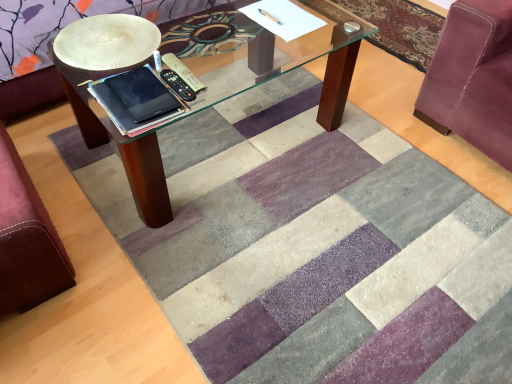
Where is `black matte tablet at center`? black matte tablet at center is located at coordinates pyautogui.click(x=142, y=94).

This screenshot has height=384, width=512. Describe the element at coordinates (400, 28) in the screenshot. I see `silky purple rug at upper right` at that location.

Based on the photo, what is the approximate height of velvet maroon swivel chair at right, marked as the 1th swivel chair in a right-to-left arrangement?

The height of velvet maroon swivel chair at right, marked as the 1th swivel chair in a right-to-left arrangement, is 26.35 inches.

In order to click on black matte tablet at center in this screenshot , I will do `click(142, 94)`.

From a real-world perspective, is black matte tablet at center physically above silky purple rug at upper right?

Indeed, from a real-world perspective, black matte tablet at center stands above silky purple rug at upper right.

Measure the distance between black matte tablet at center and silky purple rug at upper right.

black matte tablet at center is 1.75 meters from silky purple rug at upper right.

This screenshot has height=384, width=512. I want to click on ipad above the silky purple rug at upper right (from a real-world perspective), so click(x=142, y=94).

Considering their positions, is black matte tablet at center located in front of or behind silky purple rug at upper right?

In the image, black matte tablet at center appears in front of silky purple rug at upper right.

From the image's perspective, does velvet burgundy swivel chair at lower left, which is counted as the second swivel chair, starting from the right, appear lower than black plastic remote at center?

Yes.

From a real-world perspective, which is physically above, velvet burgundy swivel chair at lower left, which is counted as the second swivel chair, starting from the right, or black plastic remote at center?

From a 3D spatial view, black plastic remote at center is above.

Is the position of velvet burgundy swivel chair at lower left, the 1th swivel chair in the left-to-right sequence, more distant than that of black plastic remote at center?

No.

Would you say velvet burgundy swivel chair at lower left, which is counted as the second swivel chair, starting from the right, is to the left or to the right of black plastic remote at center in the picture?

Clearly, velvet burgundy swivel chair at lower left, which is counted as the second swivel chair, starting from the right, is on the left of black plastic remote at center in the image.

Could you tell me if velvet maroon swivel chair at right, marked as the 1th swivel chair in a right-to-left arrangement, is turned towards black plastic remote at center?

Yes, velvet maroon swivel chair at right, marked as the 1th swivel chair in a right-to-left arrangement, faces towards black plastic remote at center.

Is velvet maroon swivel chair at right, marked as the 1th swivel chair in a right-to-left arrangement, positioned before black plastic remote at center?

Yes, velvet maroon swivel chair at right, marked as the 1th swivel chair in a right-to-left arrangement, is in front of black plastic remote at center.

Which object is thinner, velvet maroon swivel chair at right, marked as the 1th swivel chair in a right-to-left arrangement, or black plastic remote at center?

With smaller width is black plastic remote at center.

Do you think velvet maroon swivel chair at right, marked as the 1th swivel chair in a right-to-left arrangement, is within velvet burgundy swivel chair at lower left, the 1th swivel chair in the left-to-right sequence, or outside of it?

velvet maroon swivel chair at right, marked as the 1th swivel chair in a right-to-left arrangement, exists outside the volume of velvet burgundy swivel chair at lower left, the 1th swivel chair in the left-to-right sequence.

Which of these two, velvet maroon swivel chair at right, marked as the 1th swivel chair in a right-to-left arrangement, or velvet burgundy swivel chair at lower left, the 1th swivel chair in the left-to-right sequence, is wider?

velvet maroon swivel chair at right, marked as the 1th swivel chair in a right-to-left arrangement, is wider.

Does point (455, 79) lie behind point (24, 290)?

Yes, it is behind point (24, 290).

From the image's perspective, between velvet maroon swivel chair at right, placed as the 2th swivel chair when sorted from left to right, and velvet burgundy swivel chair at lower left, the 1th swivel chair in the left-to-right sequence, which one is located above?

velvet maroon swivel chair at right, placed as the 2th swivel chair when sorted from left to right, from the image's perspective.

Can you confirm if silky purple rug at upper right is smaller than velvet maroon swivel chair at right, marked as the 1th swivel chair in a right-to-left arrangement?

Yes.

Consider the image. Is velvet maroon swivel chair at right, placed as the 2th swivel chair when sorted from left to right, surrounded by silky purple rug at upper right?

No, velvet maroon swivel chair at right, placed as the 2th swivel chair when sorted from left to right, is not inside silky purple rug at upper right.

From the image's perspective, is silky purple rug at upper right positioned above or below velvet maroon swivel chair at right, marked as the 1th swivel chair in a right-to-left arrangement?

silky purple rug at upper right is above velvet maroon swivel chair at right, marked as the 1th swivel chair in a right-to-left arrangement.

From a real-world perspective, which is physically above, silky purple rug at upper right or velvet maroon swivel chair at right, placed as the 2th swivel chair when sorted from left to right?

velvet maroon swivel chair at right, placed as the 2th swivel chair when sorted from left to right, is physically above.

Consider the image. Is there a large distance between black plastic remote at center and black matte tablet at center?

No, there isn't a large distance between black plastic remote at center and black matte tablet at center.

In the scene shown: Is black plastic remote at center positioned with its back to black matte tablet at center?

black plastic remote at center is not turned away from black matte tablet at center.

Is black matte tablet at center surrounded by black plastic remote at center?

That's incorrect, black matte tablet at center is not inside black plastic remote at center.

Is point (200, 82) farther from viewer compared to point (158, 100)?

Yes, point (200, 82) is farther from viewer.

Between velvet maroon swivel chair at right, placed as the 2th swivel chair when sorted from left to right, and black matte tablet at center, which one has larger width?

velvet maroon swivel chair at right, placed as the 2th swivel chair when sorted from left to right.

From the picture: How far apart are velvet maroon swivel chair at right, marked as the 1th swivel chair in a right-to-left arrangement, and black matte tablet at center?

velvet maroon swivel chair at right, marked as the 1th swivel chair in a right-to-left arrangement, is 4.08 feet away from black matte tablet at center.

Is velvet maroon swivel chair at right, placed as the 2th swivel chair when sorted from left to right, turned away from black matte tablet at center?

No, velvet maroon swivel chair at right, placed as the 2th swivel chair when sorted from left to right, is not facing away from black matte tablet at center.

Identify the location of mat behind the black matte tablet at center. pyautogui.click(x=400, y=28).

There is a velvet burgundy swivel chair at lower left, which is counted as the second swivel chair, starting from the right. What are the coordinates of `remote above it (from a real-world perspective)` in the screenshot? It's located at (183, 72).

Based on the photo, when comparing their distances from black plastic remote at center, does velvet burgundy swivel chair at lower left, which is counted as the second swivel chair, starting from the right, or black matte tablet at center seem further?

The object further to black plastic remote at center is velvet burgundy swivel chair at lower left, which is counted as the second swivel chair, starting from the right.

Looking at the image, which one is located closer to black matte tablet at center, black plastic remote at center or velvet burgundy swivel chair at lower left, the 1th swivel chair in the left-to-right sequence?

Based on the image, black plastic remote at center appears to be nearer to black matte tablet at center.

When comparing their distances from velvet maroon swivel chair at right, placed as the 2th swivel chair when sorted from left to right, does black matte tablet at center or silky purple rug at upper right seem further?

black matte tablet at center lies further to velvet maroon swivel chair at right, placed as the 2th swivel chair when sorted from left to right, than the other object.

Which object lies nearer to the anchor point black matte tablet at center, silky purple rug at upper right or velvet burgundy swivel chair at lower left, the 1th swivel chair in the left-to-right sequence?

Based on the image, velvet burgundy swivel chair at lower left, the 1th swivel chair in the left-to-right sequence, appears to be nearer to black matte tablet at center.

Estimate the real-world distances between objects in this image. Which object is closer to velvet burgundy swivel chair at lower left, the 1th swivel chair in the left-to-right sequence, black matte tablet at center or velvet maroon swivel chair at right, placed as the 2th swivel chair when sorted from left to right?

Among the two, black matte tablet at center is located nearer to velvet burgundy swivel chair at lower left, the 1th swivel chair in the left-to-right sequence.

Looking at this image, when comparing their distances from velvet maroon swivel chair at right, marked as the 1th swivel chair in a right-to-left arrangement, does velvet burgundy swivel chair at lower left, which is counted as the second swivel chair, starting from the right, or black matte tablet at center seem further?

velvet burgundy swivel chair at lower left, which is counted as the second swivel chair, starting from the right, lies further to velvet maroon swivel chair at right, marked as the 1th swivel chair in a right-to-left arrangement, than the other object.

Based on their spatial positions, is black plastic remote at center or velvet burgundy swivel chair at lower left, which is counted as the second swivel chair, starting from the right, closer to silky purple rug at upper right?

black plastic remote at center lies closer to silky purple rug at upper right than the other object.

When comparing their distances from velvet burgundy swivel chair at lower left, the 1th swivel chair in the left-to-right sequence, does black matte tablet at center or silky purple rug at upper right seem closer?

black matte tablet at center is closer to velvet burgundy swivel chair at lower left, the 1th swivel chair in the left-to-right sequence.

Identify the location of remote between black matte tablet at center and silky purple rug at upper right. (183, 72).

What are the coordinates of `ipad between velvet burgundy swivel chair at lower left, the 1th swivel chair in the left-to-right sequence, and velvet maroon swivel chair at right, placed as the 2th swivel chair when sorted from left to right, from left to right` in the screenshot? It's located at (x=142, y=94).

The width and height of the screenshot is (512, 384). Identify the location of ipad between velvet burgundy swivel chair at lower left, which is counted as the second swivel chair, starting from the right, and black plastic remote at center from left to right. (142, 94).

Find the location of a particular element. This screenshot has width=512, height=384. mat situated between velvet burgundy swivel chair at lower left, which is counted as the second swivel chair, starting from the right, and velvet maroon swivel chair at right, placed as the 2th swivel chair when sorted from left to right, from left to right is located at coordinates (400, 28).